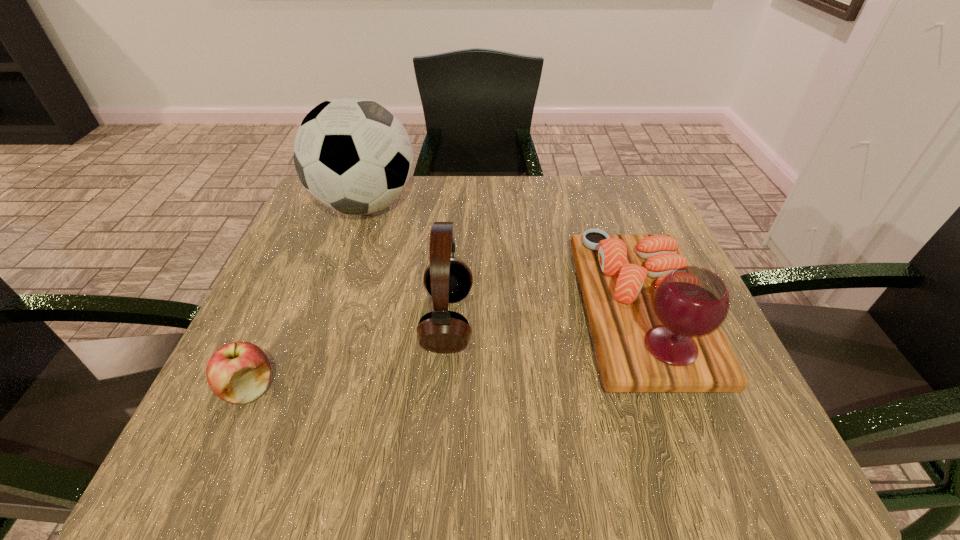
The height and width of the screenshot is (540, 960). In order to click on soccer ball in this screenshot , I will do [x=353, y=155].

This screenshot has height=540, width=960. Find the location of `the farthest object`. the farthest object is located at coordinates (353, 155).

The height and width of the screenshot is (540, 960). I want to click on headset, so click(448, 279).

Identify the location of platter. The image size is (960, 540). (655, 321).

I want to click on the shortest object, so click(239, 372).

Locate an element on the screen. This screenshot has width=960, height=540. free space located 0.370m on the main logo of the farthest object is located at coordinates (570, 205).

Image resolution: width=960 pixels, height=540 pixels. I want to click on free region located 0.320m on the ear pads of the third object from left to right, so click(x=649, y=321).

I want to click on free space located on the left of the platter, so click(x=405, y=312).

Where is `vacant space positioned 0.350m on the right of the shortest object`? vacant space positioned 0.350m on the right of the shortest object is located at coordinates (497, 388).

Identify the location of object that is at the far edge. (353, 155).